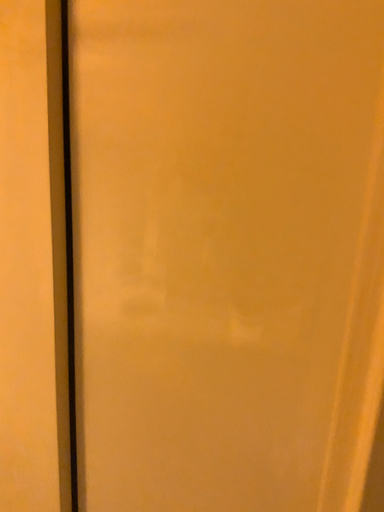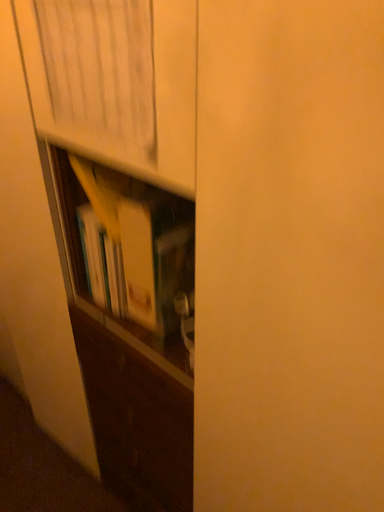
Question: How did the camera likely rotate when shooting the video?

Choices:
 (A) rotated downward
 (B) rotated upward

Answer: (A)